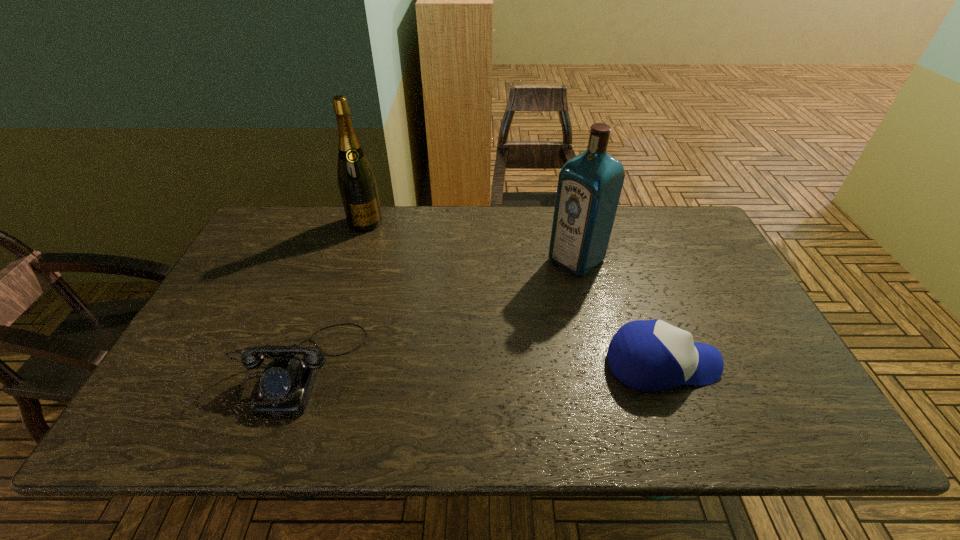
Identify the location of vacant area that lies between the wine bottle and the baseball cap. This screenshot has width=960, height=540. (514, 293).

I want to click on unoccupied area between the third nearest object and the baseball cap, so click(x=619, y=312).

What are the coordinates of `vacant area that lies between the baseball cap and the farthest object` in the screenshot? It's located at (514, 293).

At what (x,y) coordinates should I click in order to perform the action: click on object that is the second closest to the baseball cap. Please return your answer as a coordinate pair (x, y). The image size is (960, 540). Looking at the image, I should click on (286, 383).

Select which object appears as the second closest to the telephone. Please provide its 2D coordinates. Your answer should be formatted as a tuple, i.e. [(x, y)], where the tuple contains the x and y coordinates of a point satisfying the conditions above.

[(589, 186)]

Where is `free space that satisfies the following two spatial constraints: 1. on the front side of the baseball cap; 2. on the front-facing side of the farthest object`? The image size is (960, 540). free space that satisfies the following two spatial constraints: 1. on the front side of the baseball cap; 2. on the front-facing side of the farthest object is located at coordinates (320, 364).

Find the location of `free point that satisfies the following two spatial constraints: 1. on the front side of the wine bottle; 2. on the front-facing side of the baseball cap`. free point that satisfies the following two spatial constraints: 1. on the front side of the wine bottle; 2. on the front-facing side of the baseball cap is located at coordinates (320, 364).